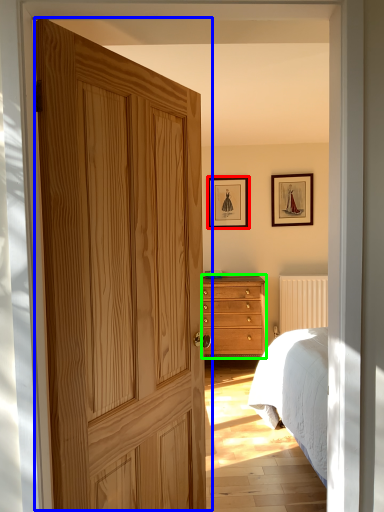
Question: Which object is positioned closest to picture frame (highlighted by a red box)? Select from door (highlighted by a blue box) and chest of drawers (highlighted by a green box).

Choices:
 (A) door
 (B) chest of drawers

Answer: (B)